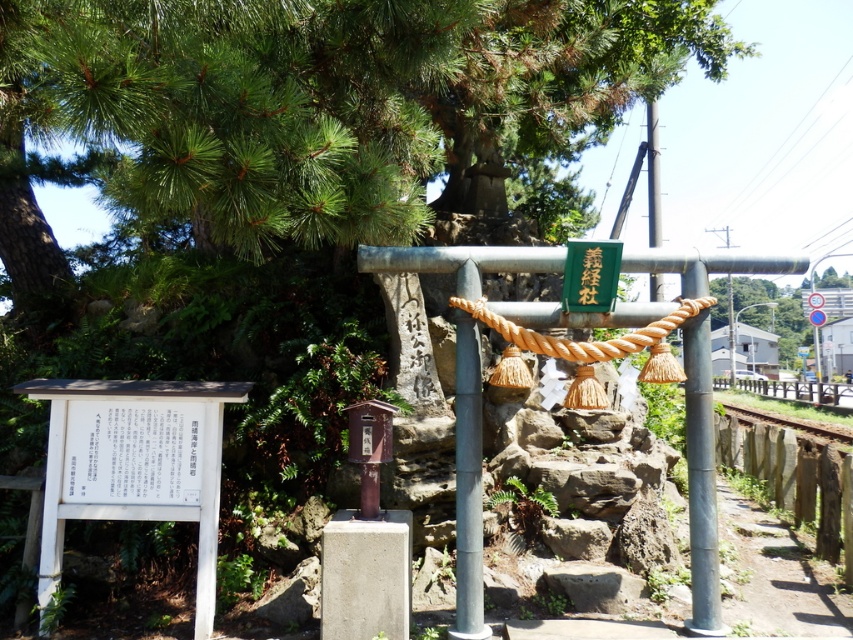
Question: Can you confirm if white paper sign at lower center is wider than gray metallic pole at center?

Choices:
 (A) no
 (B) yes

Answer: (B)

Question: Can you confirm if gray metallic pole at center is positioned above green leafy tree at right?

Choices:
 (A) yes
 (B) no

Answer: (B)

Question: Which object is farther from the camera taking this photo?

Choices:
 (A) green leafy tree at right
 (B) roperough at center
 (C) white paper sign at lower center

Answer: (A)

Question: Which point is farther from the camera taking this photo?

Choices:
 (A) (514, 336)
 (B) (465, 426)
 (C) (718, 621)

Answer: (B)

Question: Which of the following is the farthest from the observer?

Choices:
 (A) 469,520
 (B) 778,419

Answer: (B)

Question: Is metallic gray pole at right above gray metallic pole at center?

Choices:
 (A) yes
 (B) no

Answer: (B)